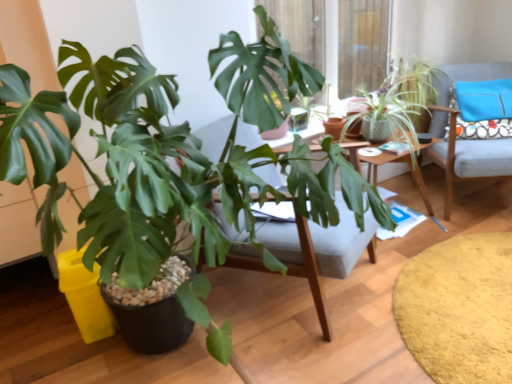
Question: From a real-world perspective, is green matte plant at center, the first houseplant viewed from the left, positioned above or below light gray fabric chair at right?

Choices:
 (A) below
 (B) above

Answer: (B)

Question: Relative to light gray fabric chair at right, is green matte plant at center, which is counted as the first houseplant, starting from the front, in front or behind?

Choices:
 (A) behind
 (B) front

Answer: (B)

Question: Which object is the closest to the green textured plant at upper right, the second houseplant from the front?

Choices:
 (A) wooden desk at center
 (B) light gray fabric chair at right
 (C) green matte plant at center, which ranks as the second houseplant in back-to-front order
 (D) wooden swivel chair at center
 (E) soft yellow rug at lower right

Answer: (B)

Question: Based on their relative distances, which object is farther from the green textured plant at upper right, which ranks as the first houseplant in back-to-front order?

Choices:
 (A) soft yellow rug at lower right
 (B) wooden swivel chair at center
 (C) wooden desk at center
 (D) blue fabric pillow at upper right
 (E) green matte plant at center, which is counted as the first houseplant, starting from the front

Answer: (E)